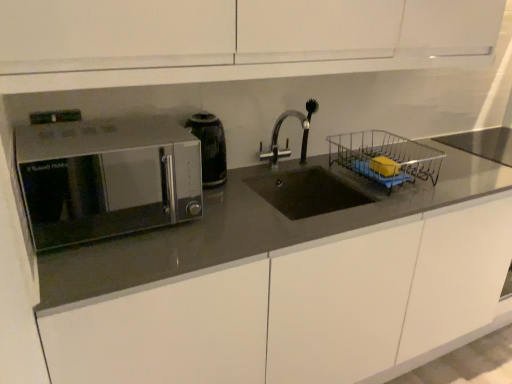
This screenshot has height=384, width=512. Find the location of `free space below satin silver microwave at left (from a real-world perspective)`. free space below satin silver microwave at left (from a real-world perspective) is located at coordinates (114, 228).